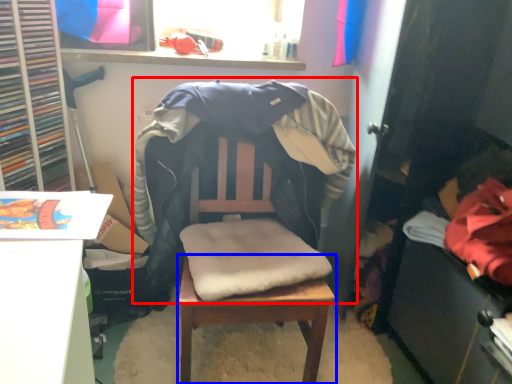
Question: Among these objects, which one is nearest to the camera, bean bag chair (highlighted by a red box) or table (highlighted by a blue box)?

Choices:
 (A) bean bag chair
 (B) table

Answer: (A)